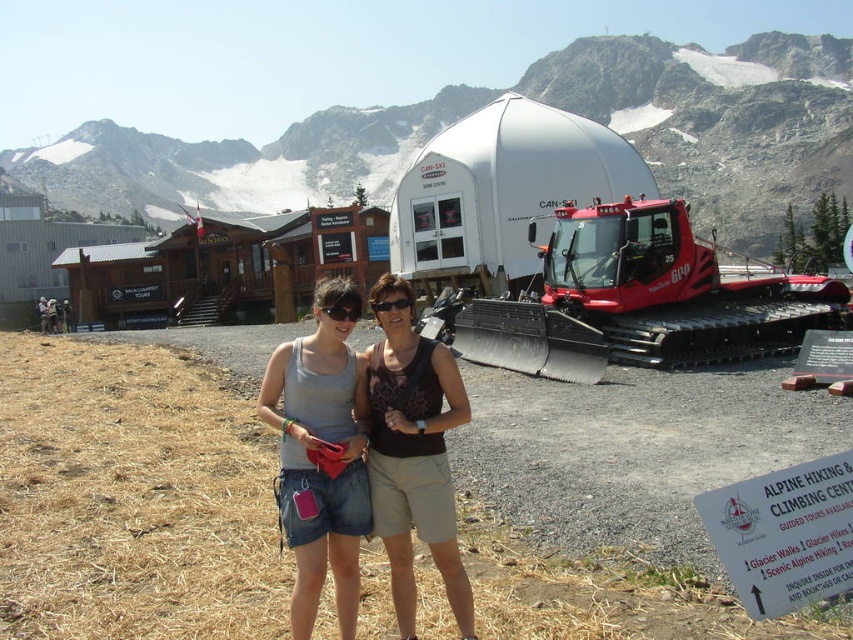
You are planning to take a photo of both the white matte dome at upper center and the red rubber tractor at right. Based on their positions, which object should you place on the left side of your camera frame to include both in the shot?

The white matte dome at upper center is positioned on the left side of red rubber tractor at right, so you should place the white matte dome at upper center on the left side of your camera frame to include both in the shot.

You are planning to take a group photo of the two people in the scene. The photographer wants to ensure that both the red rubber tractor at right and the matte gray tank top at center are visible in the frame. Which object should be placed closer to the camera to ensure both are in focus?

The red rubber tractor at right is bigger than the matte gray tank top at center. To ensure both are in focus, the smaller matte gray tank top at center should be placed closer to the camera. This way, the depth of field will accommodate both the closer smaller object and the larger tractor in the background.